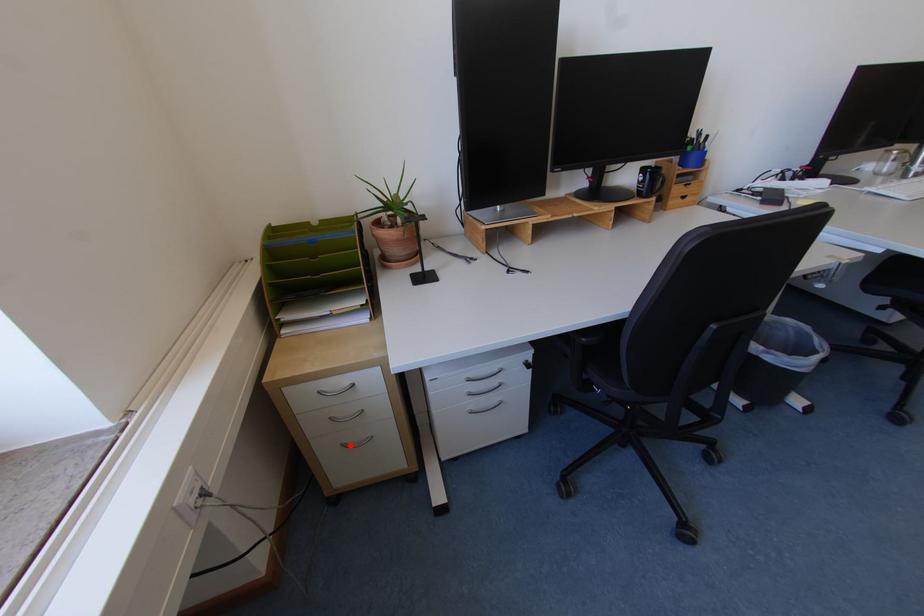
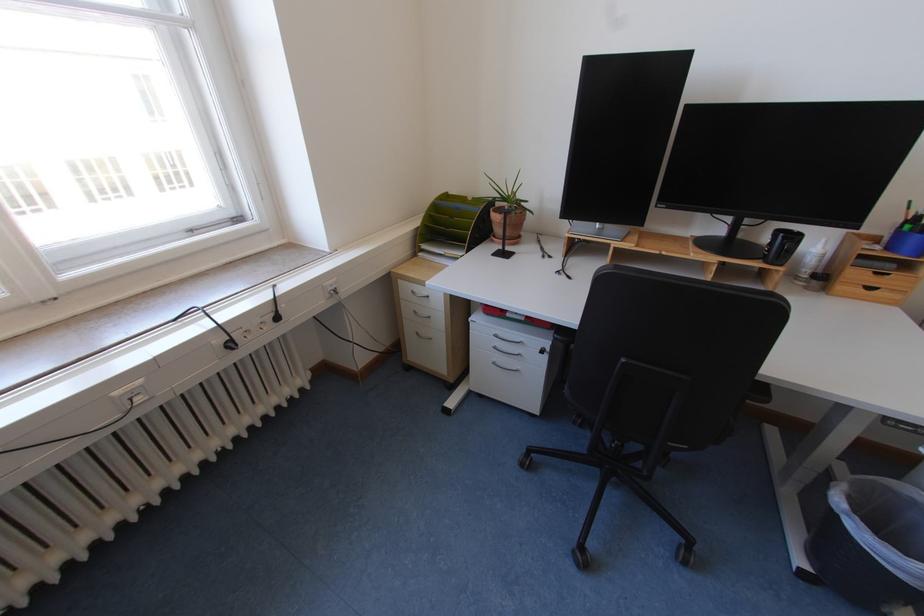
The point at the highlighted location is marked in the first image. Where is the corresponding point in the second image?

(426, 334)